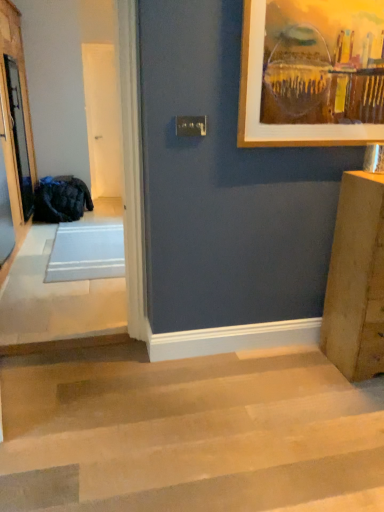
What is the approximate width of light brown wooden stairs at lower left?

light brown wooden stairs at lower left is 3.78 feet in width.

Locate an element on the screen. light brown wooden stairs at lower left is located at coordinates (188, 432).

The width and height of the screenshot is (384, 512). What do you see at coordinates (102, 119) in the screenshot?
I see `white glossy door at center, the 2th screen door when ordered from left to right` at bounding box center [102, 119].

What do you see at coordinates (61, 200) in the screenshot? Image resolution: width=384 pixels, height=512 pixels. I see `dark blue fabric bag at left` at bounding box center [61, 200].

What are the coordinates of `clear glass screen door at left, the 1th screen door from the left` in the screenshot? It's located at (15, 125).

Is white glossy door at center, the 2th screen door when ordered from left to right, not close to clear glass screen door at left, which appears as the 1th screen door when viewed from the front?

Yes, white glossy door at center, the 2th screen door when ordered from left to right, and clear glass screen door at left, which appears as the 1th screen door when viewed from the front, are quite far apart.

Which of these two, white glossy door at center, marked as the 1th screen door in a back-to-front arrangement, or clear glass screen door at left, positioned as the second screen door in right-to-left order, is smaller?

white glossy door at center, marked as the 1th screen door in a back-to-front arrangement, is smaller.

From the image's perspective, is white glossy door at center, the 2th screen door when ordered from left to right, located above or below clear glass screen door at left, the 1th screen door from the left?

white glossy door at center, the 2th screen door when ordered from left to right, is above clear glass screen door at left, the 1th screen door from the left.

From a real-world perspective, relative to clear glass screen door at left, positioned as the second screen door in right-to-left order, is white glossy door at center, marked as the first screen door in a right-to-left arrangement, vertically above or below?

From a real-world perspective, white glossy door at center, marked as the first screen door in a right-to-left arrangement, is physically above clear glass screen door at left, positioned as the second screen door in right-to-left order.

Is dark blue fabric bag at left taller than white glossy door at center, the 2th screen door when ordered from front to back?

No, dark blue fabric bag at left is not taller than white glossy door at center, the 2th screen door when ordered from front to back.

Based on the photo, is dark blue fabric bag at left far from white glossy door at center, marked as the 1th screen door in a back-to-front arrangement?

Yes, dark blue fabric bag at left is far from white glossy door at center, marked as the 1th screen door in a back-to-front arrangement.

Is dark blue fabric bag at left to the left of white glossy door at center, marked as the 1th screen door in a back-to-front arrangement, from the viewer's perspective?

Correct, you'll find dark blue fabric bag at left to the left of white glossy door at center, marked as the 1th screen door in a back-to-front arrangement.

Identify the location of laundry that appears on the left of white glossy door at center, the 2th screen door when ordered from front to back. This screenshot has height=512, width=384. (61, 200).

In order to click on screen door lying below the dark blue fabric bag at left (from the image's perspective) in this screenshot , I will do `click(15, 125)`.

Is clear glass screen door at left, which is counted as the second screen door, starting from the back, inside or outside of dark blue fabric bag at left?

clear glass screen door at left, which is counted as the second screen door, starting from the back, cannot be found inside dark blue fabric bag at left.

Considering the relative positions of clear glass screen door at left, which is counted as the second screen door, starting from the back, and dark blue fabric bag at left in the image provided, is clear glass screen door at left, which is counted as the second screen door, starting from the back, to the left or to the right of dark blue fabric bag at left?

clear glass screen door at left, which is counted as the second screen door, starting from the back, is positioned on dark blue fabric bag at left's right side.

Does clear glass screen door at left, the 1th screen door from the left, lie behind dark blue fabric bag at left?

No, clear glass screen door at left, the 1th screen door from the left, is closer to the camera.

Which is behind, point (77, 178) or point (9, 180)?

Point (77, 178)

Considering the relative sizes of dark blue fabric bag at left and clear glass screen door at left, positioned as the second screen door in right-to-left order, in the image provided, is dark blue fabric bag at left taller than clear glass screen door at left, positioned as the second screen door in right-to-left order,?

Incorrect, the height of dark blue fabric bag at left is not larger of that of clear glass screen door at left, positioned as the second screen door in right-to-left order.

From a real-world perspective, is dark blue fabric bag at left located beneath clear glass screen door at left, which appears as the 1th screen door when viewed from the front?

Yes, from a real-world perspective, dark blue fabric bag at left is below clear glass screen door at left, which appears as the 1th screen door when viewed from the front.

Is dark blue fabric bag at left located outside clear glass screen door at left, the 1th screen door from the left?

dark blue fabric bag at left is positioned outside clear glass screen door at left, the 1th screen door from the left.

What's the angular difference between white glossy door at center, the 2th screen door when ordered from front to back, and light brown wooden stairs at lower left's facing directions?

179 degrees separate the facing orientations of white glossy door at center, the 2th screen door when ordered from front to back, and light brown wooden stairs at lower left.

Is white glossy door at center, the 2th screen door when ordered from left to right, shorter than light brown wooden stairs at lower left?

No, white glossy door at center, the 2th screen door when ordered from left to right, is not shorter than light brown wooden stairs at lower left.

Does white glossy door at center, marked as the first screen door in a right-to-left arrangement, lie in front of light brown wooden stairs at lower left?

No, it is not.

Can you tell me how much white glossy door at center, the 2th screen door when ordered from front to back, and dark blue fabric bag at left differ in facing direction?

They differ by 0.000627 degrees in their facing directions.

Measure the distance from white glossy door at center, marked as the first screen door in a right-to-left arrangement, to dark blue fabric bag at left.

white glossy door at center, marked as the first screen door in a right-to-left arrangement, and dark blue fabric bag at left are 1.29 meters apart from each other.

This screenshot has width=384, height=512. Identify the location of laundry on the left of white glossy door at center, the 2th screen door when ordered from left to right. 61,200.

Which is in front, white glossy door at center, the 2th screen door when ordered from left to right, or dark blue fabric bag at left?

Positioned in front is dark blue fabric bag at left.

Is the depth of clear glass screen door at left, which appears as the 1th screen door when viewed from the front, less than that of light brown wooden stairs at lower left?

No, clear glass screen door at left, which appears as the 1th screen door when viewed from the front, is further to the viewer.

Could you measure the distance between clear glass screen door at left, positioned as the second screen door in right-to-left order, and light brown wooden stairs at lower left?

clear glass screen door at left, positioned as the second screen door in right-to-left order, is 2.32 meters away from light brown wooden stairs at lower left.

Could you tell me if clear glass screen door at left, the 1th screen door from the left, is facing light brown wooden stairs at lower left?

No, clear glass screen door at left, the 1th screen door from the left, is not turned towards light brown wooden stairs at lower left.

Is clear glass screen door at left, positioned as the second screen door in right-to-left order, surrounding light brown wooden stairs at lower left?

No, clear glass screen door at left, positioned as the second screen door in right-to-left order, does not contain light brown wooden stairs at lower left.

Where is `screen door in front of the white glossy door at center, the 2th screen door when ordered from left to right`? screen door in front of the white glossy door at center, the 2th screen door when ordered from left to right is located at coordinates (15, 125).

Find the location of a particular element. screen door lying behind the dark blue fabric bag at left is located at coordinates (102, 119).

Which object lies nearer to the anchor point clear glass screen door at left, which appears as the 1th screen door when viewed from the front, light brown wooden stairs at lower left or dark blue fabric bag at left?

dark blue fabric bag at left.

Considering their positions, is white glossy door at center, marked as the first screen door in a right-to-left arrangement, positioned further to light brown wooden stairs at lower left than dark blue fabric bag at left?

The object further to light brown wooden stairs at lower left is white glossy door at center, marked as the first screen door in a right-to-left arrangement.

Which object lies nearer to the anchor point light brown wooden stairs at lower left, dark blue fabric bag at left or clear glass screen door at left, which appears as the 1th screen door when viewed from the front?

Among the two, clear glass screen door at left, which appears as the 1th screen door when viewed from the front, is located nearer to light brown wooden stairs at lower left.

From the image, which object appears to be nearer to white glossy door at center, the 2th screen door when ordered from front to back, clear glass screen door at left, the 1th screen door from the left, or dark blue fabric bag at left?

dark blue fabric bag at left lies closer to white glossy door at center, the 2th screen door when ordered from front to back, than the other object.

Which object lies nearer to the anchor point clear glass screen door at left, the 1th screen door from the left, white glossy door at center, marked as the 1th screen door in a back-to-front arrangement, or dark blue fabric bag at left?

Based on the image, dark blue fabric bag at left appears to be nearer to clear glass screen door at left, the 1th screen door from the left.

Based on their spatial positions, is light brown wooden stairs at lower left or clear glass screen door at left, which appears as the 1th screen door when viewed from the front, closer to white glossy door at center, marked as the 1th screen door in a back-to-front arrangement?

clear glass screen door at left, which appears as the 1th screen door when viewed from the front, is positioned closer to the anchor white glossy door at center, marked as the 1th screen door in a back-to-front arrangement.

Which object lies nearer to the anchor point clear glass screen door at left, which is counted as the second screen door, starting from the back, white glossy door at center, marked as the 1th screen door in a back-to-front arrangement, or light brown wooden stairs at lower left?

Among the two, white glossy door at center, marked as the 1th screen door in a back-to-front arrangement, is located nearer to clear glass screen door at left, which is counted as the second screen door, starting from the back.

When comparing their distances from white glossy door at center, the 2th screen door when ordered from left to right, does dark blue fabric bag at left or light brown wooden stairs at lower left seem closer?

dark blue fabric bag at left is positioned closer to the anchor white glossy door at center, the 2th screen door when ordered from left to right.

The width and height of the screenshot is (384, 512). Identify the location of laundry between clear glass screen door at left, positioned as the second screen door in right-to-left order, and white glossy door at center, the 2th screen door when ordered from front to back, along the z-axis. (61, 200).

Find the location of a particular element. This screenshot has height=512, width=384. screen door between light brown wooden stairs at lower left and white glossy door at center, the 2th screen door when ordered from left to right, along the z-axis is located at coordinates (15, 125).

The image size is (384, 512). I want to click on laundry between light brown wooden stairs at lower left and white glossy door at center, the 2th screen door when ordered from front to back, from front to back, so click(61, 200).

Where is `screen door between light brown wooden stairs at lower left and dark blue fabric bag at left from front to back`? Image resolution: width=384 pixels, height=512 pixels. screen door between light brown wooden stairs at lower left and dark blue fabric bag at left from front to back is located at coordinates (15, 125).